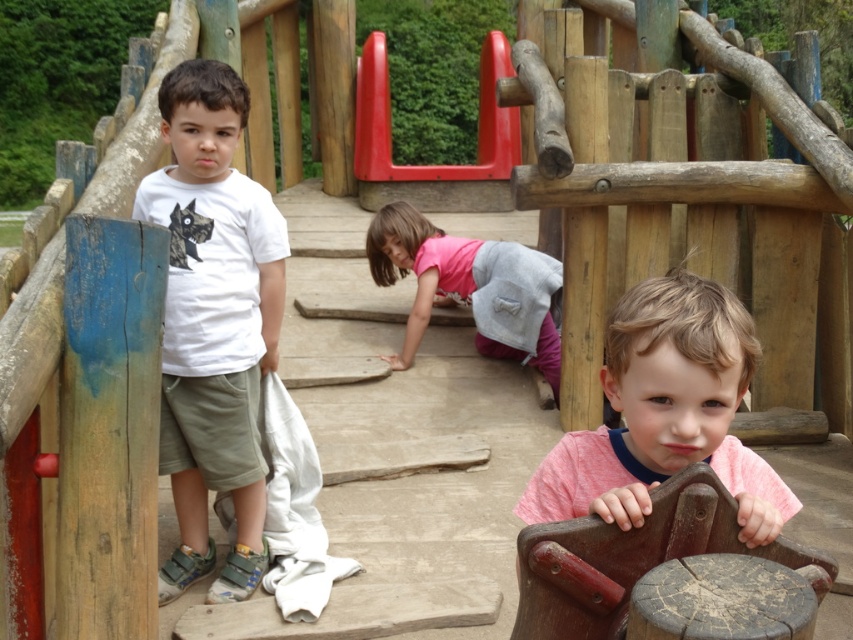
Question: Can you confirm if white matte t-shirt at left is positioned to the right of wooden log at center?

Choices:
 (A) no
 (B) yes

Answer: (A)

Question: Can you confirm if pink matte shirt at center is positioned to the left of wooden log at center?

Choices:
 (A) no
 (B) yes

Answer: (A)

Question: Among these objects, which one is nearest to the camera?

Choices:
 (A) smooth plastic slide at upper center
 (B) pink fabric at center
 (C) pink matte shirt at center
 (D) white matte t-shirt at left

Answer: (C)

Question: Which object is positioned farthest from the pink matte shirt at center?

Choices:
 (A) wooden log at center
 (B) smooth plastic slide at upper center

Answer: (B)

Question: Can you confirm if wooden log at center is positioned above smooth plastic slide at upper center?

Choices:
 (A) yes
 (B) no

Answer: (B)

Question: Estimate the real-world distances between objects in this image. Which object is closer to the smooth plastic slide at upper center?

Choices:
 (A) pink matte shirt at center
 (B) pink fabric at center

Answer: (B)